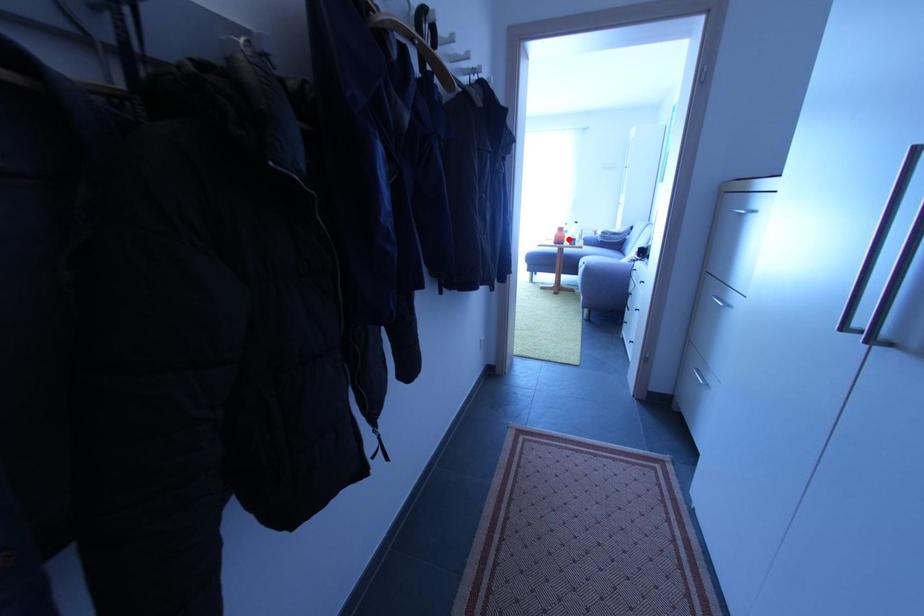
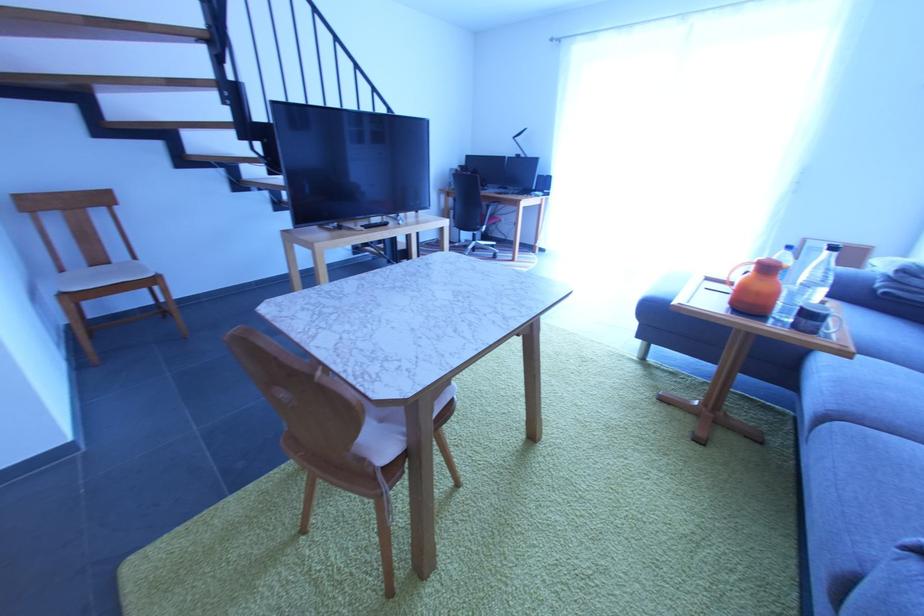
Question: I am providing you with two images of the same scene from different viewpoints. Image1 has a red point marked. In image2, the corresponding 3D location appears at what relative position? Reply with the corresponding letter.

Choices:
 (A) Closer
 (B) Farther

Answer: (B)